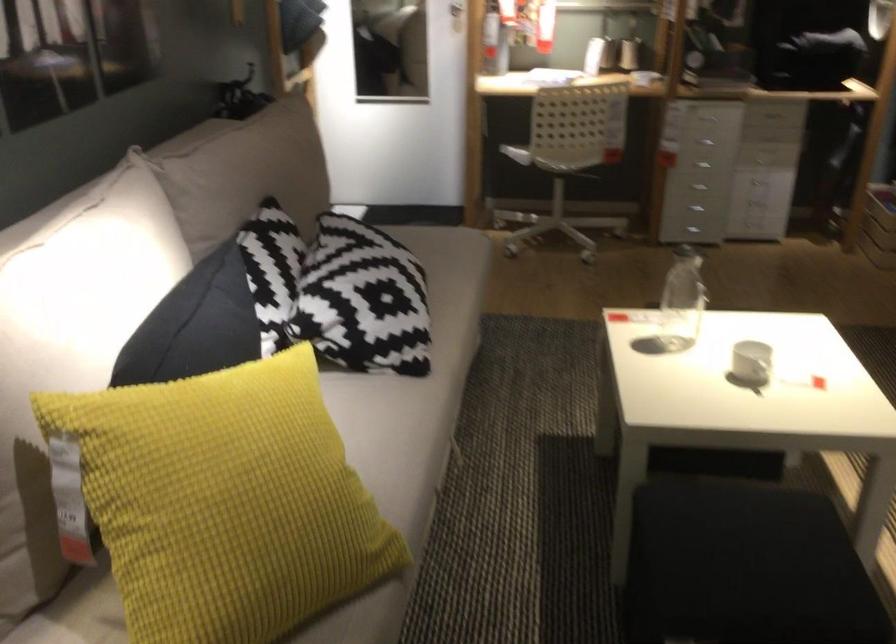
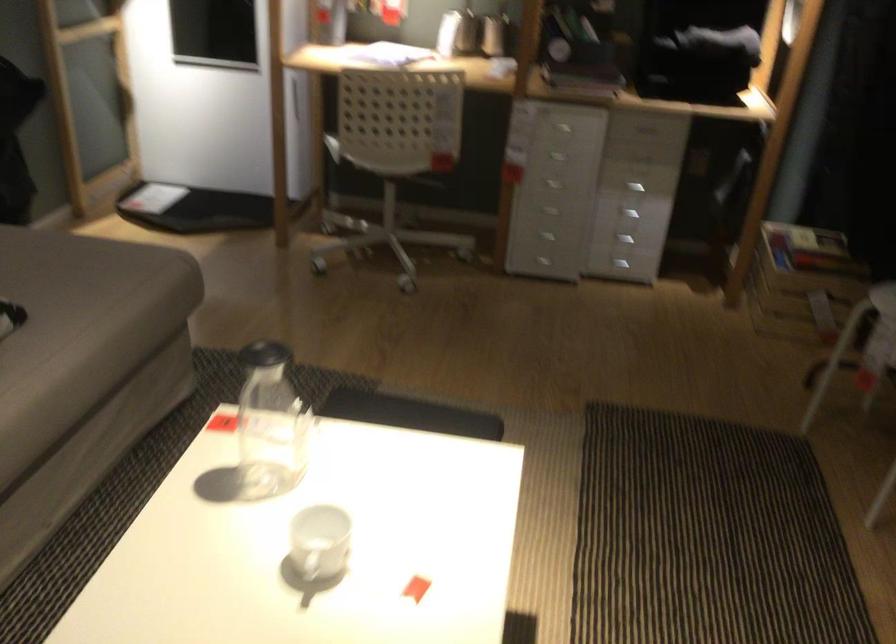
Where in the second image is the point corresponding to (x=575, y=152) from the first image?

(388, 158)